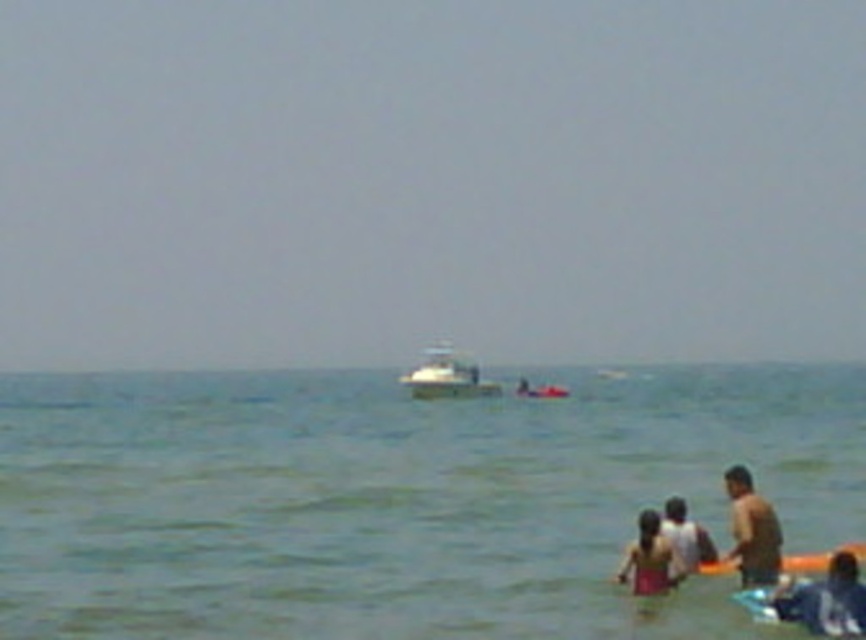
Question: Can you confirm if pink fabric at lower center is positioned below white t-shirt at lower right?

Choices:
 (A) no
 (B) yes

Answer: (B)

Question: Is tan skin man at lower right bigger than white t-shirt at lower right?

Choices:
 (A) yes
 (B) no

Answer: (B)

Question: Which object is positioned closest to the tan skin man at lower right?

Choices:
 (A) blue fabric shirt at lower right
 (B) white glossy boat at center

Answer: (A)

Question: Which of the following is the farthest from the observer?

Choices:
 (A) (472, 390)
 (B) (832, 577)

Answer: (A)

Question: From the image, what is the correct spatial relationship of clear blue water at center in relation to tan skin man at lower right?

Choices:
 (A) below
 (B) above

Answer: (B)

Question: Which object is the farthest from the blue fabric shirt at lower right?

Choices:
 (A) pink fabric at lower center
 (B) white t-shirt at lower right
 (C) tan skin man at lower right

Answer: (A)